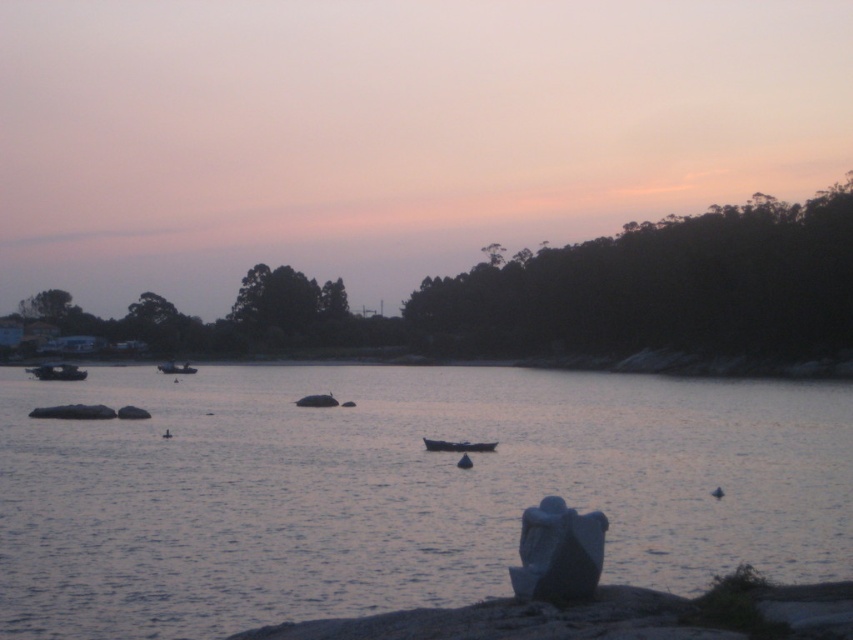
Question: Is dull blue water at center above metallic gray boat at center?

Choices:
 (A) no
 (B) yes

Answer: (B)

Question: Which point is closer to the camera taking this photo?

Choices:
 (A) (466, 417)
 (B) (42, 378)
 (C) (323, 397)
 (D) (171, 371)

Answer: (A)

Question: From the image, what is the correct spatial relationship of metallic gray boat at left in relation to smooth gray rock at center?

Choices:
 (A) below
 (B) above

Answer: (B)

Question: Which point is closer to the camera taking this photo?

Choices:
 (A) (305, 396)
 (B) (61, 371)

Answer: (A)

Question: Can you confirm if metallic gray boat at left is smaller than smooth gray rock at center?

Choices:
 (A) no
 (B) yes

Answer: (A)

Question: Which point is farther from the camera taking this photo?

Choices:
 (A) (161, 371)
 (B) (265, 460)
 (C) (444, 449)
 (D) (305, 401)

Answer: (A)